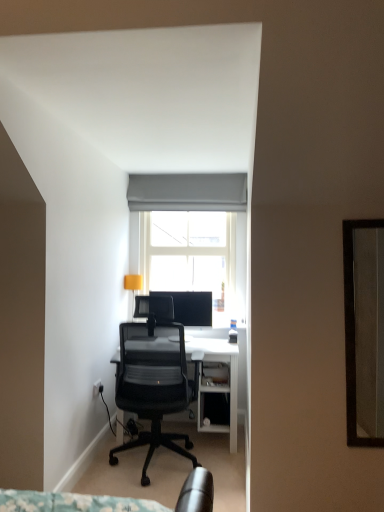
Question: From a real-world perspective, is white glass window at center below black mesh office chair at center?

Choices:
 (A) no
 (B) yes

Answer: (A)

Question: Is black mesh office chair at center surrounded by white glass window at center?

Choices:
 (A) yes
 (B) no

Answer: (B)

Question: Is white glass window at center far away from black mesh office chair at center?

Choices:
 (A) no
 (B) yes

Answer: (B)

Question: Is white glass window at center looking in the opposite direction of black mesh office chair at center?

Choices:
 (A) yes
 (B) no

Answer: (B)

Question: Is white glass window at center touching black mesh office chair at center?

Choices:
 (A) yes
 (B) no

Answer: (B)

Question: In terms of width, does white glass window at center look wider or thinner when compared to black mesh office chair at center?

Choices:
 (A) wide
 (B) thin

Answer: (B)

Question: Considering the relative positions of white glass window at center and black mesh office chair at center in the image provided, is white glass window at center to the left or to the right of black mesh office chair at center?

Choices:
 (A) left
 (B) right

Answer: (B)

Question: Is white glass window at center inside the boundaries of black mesh office chair at center, or outside?

Choices:
 (A) outside
 (B) inside

Answer: (A)

Question: In terms of height, does white glass window at center look taller or shorter compared to black mesh office chair at center?

Choices:
 (A) tall
 (B) short

Answer: (B)

Question: Would you say white glass window at center is to the left or to the right of matte black monitor at center in the picture?

Choices:
 (A) right
 (B) left

Answer: (A)

Question: From their relative heights in the image, would you say white glass window at center is taller or shorter than matte black monitor at center?

Choices:
 (A) short
 (B) tall

Answer: (B)

Question: From the image's perspective, is white glass window at center located above or below matte black monitor at center?

Choices:
 (A) below
 (B) above

Answer: (B)

Question: Is white glass window at center wider or thinner than matte black monitor at center?

Choices:
 (A) wide
 (B) thin

Answer: (A)

Question: Visually, is matte yellow lampshade at upper left positioned to the left or to the right of gray fabric curtain at upper center?

Choices:
 (A) left
 (B) right

Answer: (A)

Question: Is point (125, 276) closer or farther from the camera than point (241, 182)?

Choices:
 (A) closer
 (B) farther

Answer: (A)